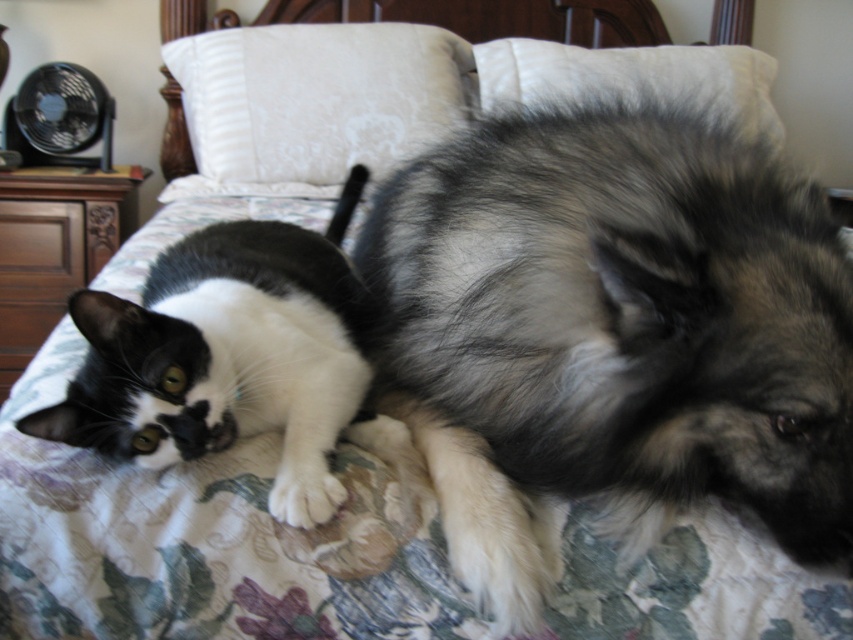
You are trying to decide if the gray fluffy dog at center can lie down on the white soft pillow at upper center without hanging off the edges. Based on their sizes, do you think it will fit?

The gray fluffy dog at center is narrower than the white soft pillow at upper center, so it should fit comfortably without hanging off the edges.

You are a photographer trying to capture a photo of the black and white fur cat at center and the white soft pillow at upper center. From your current position, which object is closer to the camera?

The black and white fur cat at center is located below the white soft pillow at upper center, so the white soft pillow at upper center is closer to the camera.